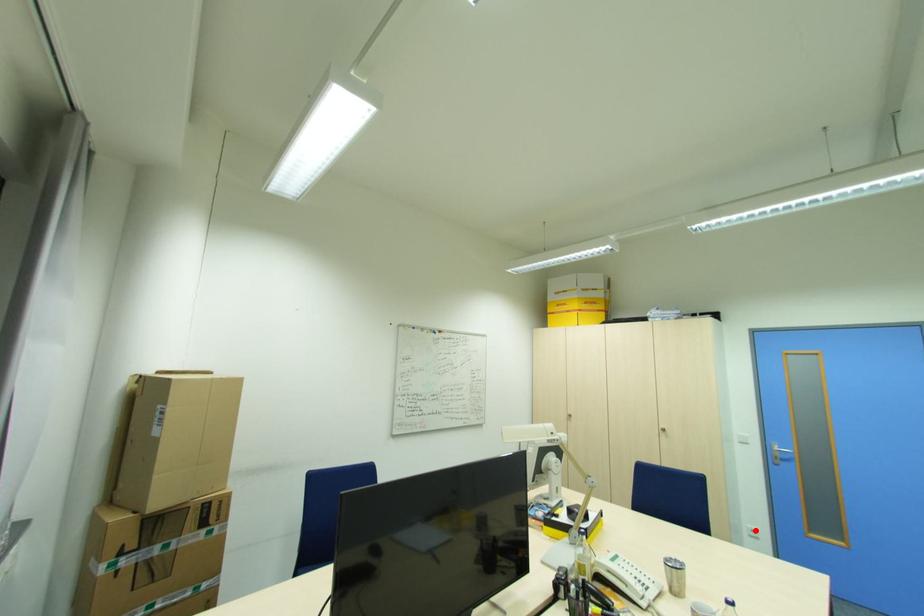
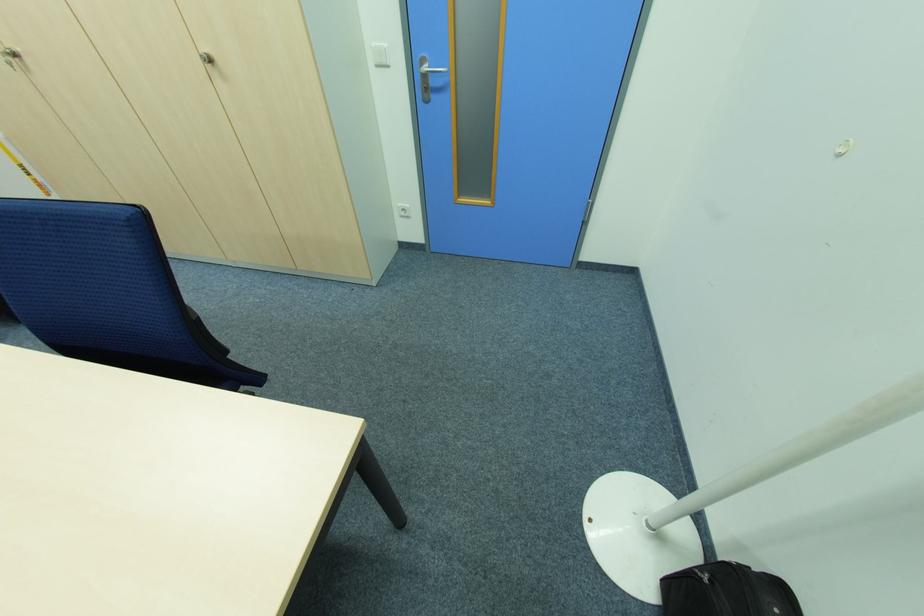
Question: I am providing you with two images of the same scene from different viewpoints. Given a red point in image1, look at the same physical point in image2. Is it:

Choices:
 (A) Closer to the viewpoint
 (B) Farther from the viewpoint

Answer: (A)